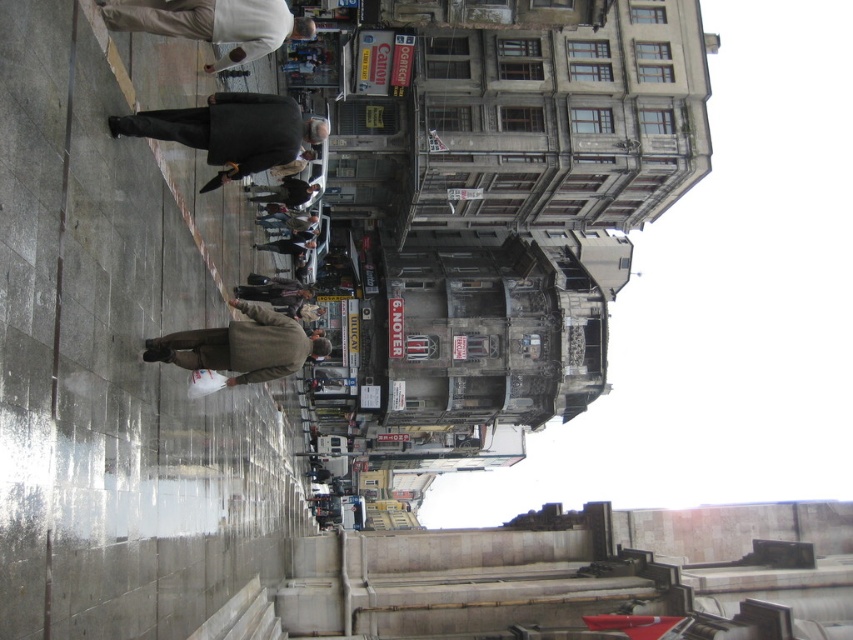
You are a fashion designer observing the urban street scene. You notice the dark wool coat at center and the white matte jacket at upper center. Which clothing item would require more fabric to produce, based on their sizes?

The dark wool coat at center is larger in size than the white matte jacket at upper center, so it would require more fabric to produce.

You are a delivery person who needs to hand over a package to the recipient. You see two people wearing coats in the scene. The recipient is wearing a dark wool coat at center. Which coat should you look for, the one above or below the brown woolen coat at lower center?

The dark wool coat at center is located above the brown woolen coat at lower center, so you should look for the coat above the brown woolen coat at lower center.